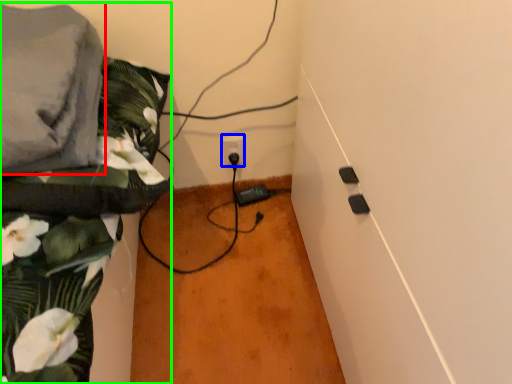
Question: Estimate the real-world distances between objects in this image. Which object is farther from linen (highlighted by a red box), power plugs and sockets (highlighted by a blue box) or textile (highlighted by a green box)?

Choices:
 (A) power plugs and sockets
 (B) textile

Answer: (A)